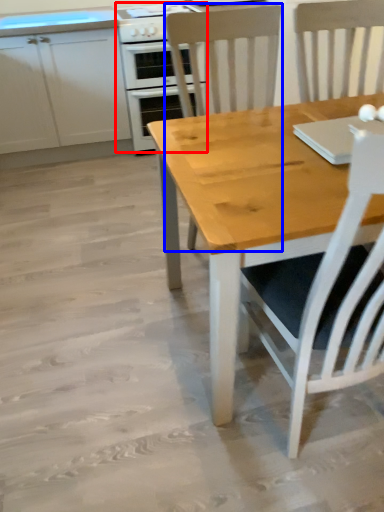
Question: Which object is closer to the camera taking this photo, kitchen appliance (highlighted by a red box) or chair (highlighted by a blue box)?

Choices:
 (A) kitchen appliance
 (B) chair

Answer: (B)